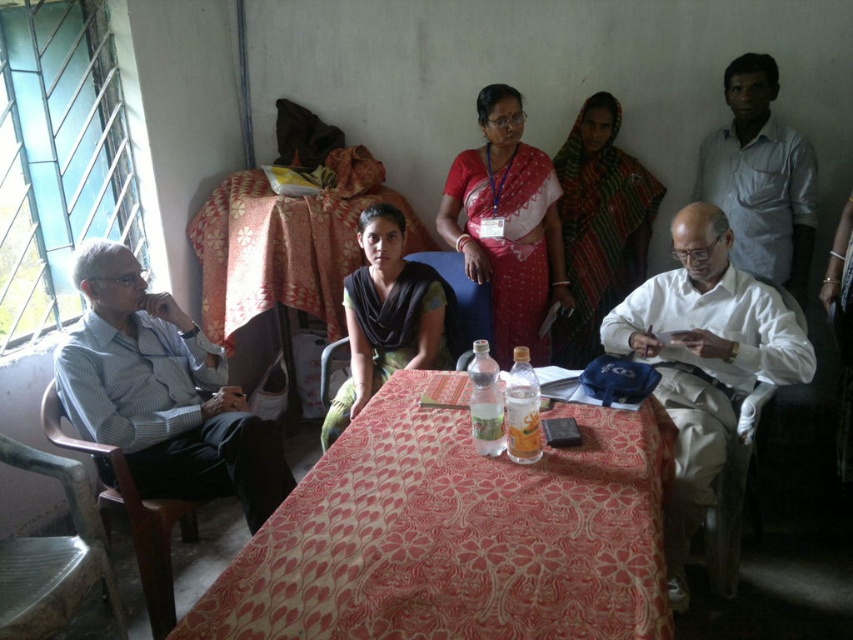
Question: Which of the following is the closest to the observer?

Choices:
 (A) (537, 256)
 (B) (401, 388)
 (C) (735, 188)

Answer: (B)

Question: Which point appears farthest from the camera in this image?

Choices:
 (A) click(x=537, y=284)
 (B) click(x=500, y=554)
 (C) click(x=708, y=192)
 (D) click(x=96, y=396)

Answer: (A)

Question: Which is farther from the black fabric saree at center?

Choices:
 (A) matte red saree at center
 (B) patterned fabric table at center
 (C) white striped shirt at left
 (D) white cotton shirt at right

Answer: (D)

Question: Is patterned fabric table at center wider than floral fabric tablecloth at center?

Choices:
 (A) yes
 (B) no

Answer: (B)

Question: Can you confirm if white striped shirt at left is positioned to the left of black fabric saree at center?

Choices:
 (A) no
 (B) yes

Answer: (B)

Question: Can you confirm if white cotton shirt at right is positioned to the right of floral fabric tablecloth at center?

Choices:
 (A) yes
 (B) no

Answer: (A)